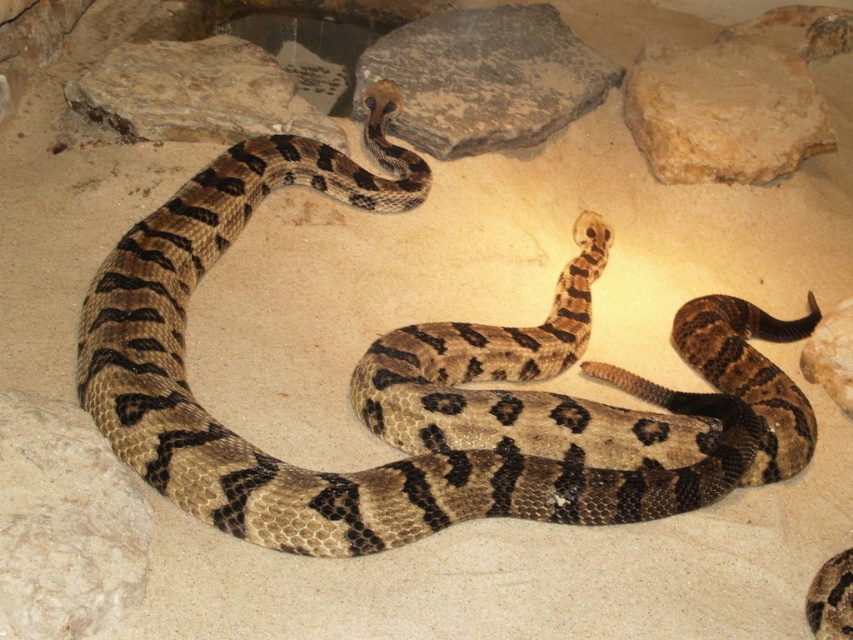
Does beige rough rock at lower left have a greater height compared to smooth rock at lower right?

Indeed, beige rough rock at lower left has a greater height compared to smooth rock at lower right.

Can you confirm if beige rough rock at lower left is shorter than smooth rock at lower right?

In fact, beige rough rock at lower left may be taller than smooth rock at lower right.

Is point (73, 632) positioned behind point (840, 365)?

No, it is in front of (840, 365).

This screenshot has width=853, height=640. Identify the location of beige rough rock at lower left. (65, 524).

Which is below, brown scaly snake at center or smooth beige rock at upper right?

brown scaly snake at center is below.

Is point (109, 394) farther from viewer compared to point (726, 38)?

No, it is not.

Find the location of a particular element. The height and width of the screenshot is (640, 853). brown scaly snake at center is located at coordinates (426, 385).

Measure the distance between gray rock at upper center and smooth beige rock at upper right.

A distance of 20.56 inches exists between gray rock at upper center and smooth beige rock at upper right.

Is point (402, 77) positioned in front of point (732, 84)?

Yes.

What do you see at coordinates (485, 77) in the screenshot? This screenshot has height=640, width=853. I see `gray rock at upper center` at bounding box center [485, 77].

You are a GUI agent. You are given a task and a screenshot of the screen. Output one action in this format:
    pyautogui.click(x=<x>, y=<y>)
    Task: Click on the gray rock at upper center
    This screenshot has width=853, height=640.
    Given the screenshot: What is the action you would take?
    pyautogui.click(x=485, y=77)